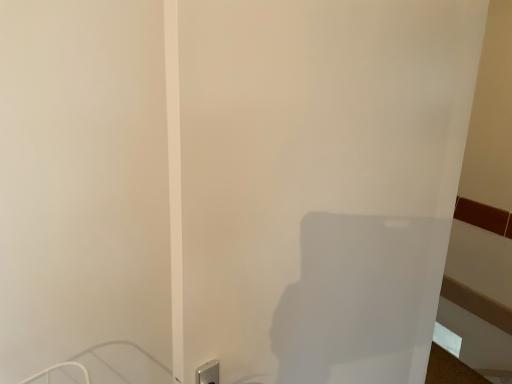
Find the location of a particular element. white glossy door at center is located at coordinates (315, 182).

The image size is (512, 384). What do you see at coordinates (315, 182) in the screenshot?
I see `white glossy door at center` at bounding box center [315, 182].

Locate an element on the screen. The image size is (512, 384). white glossy door at center is located at coordinates (315, 182).